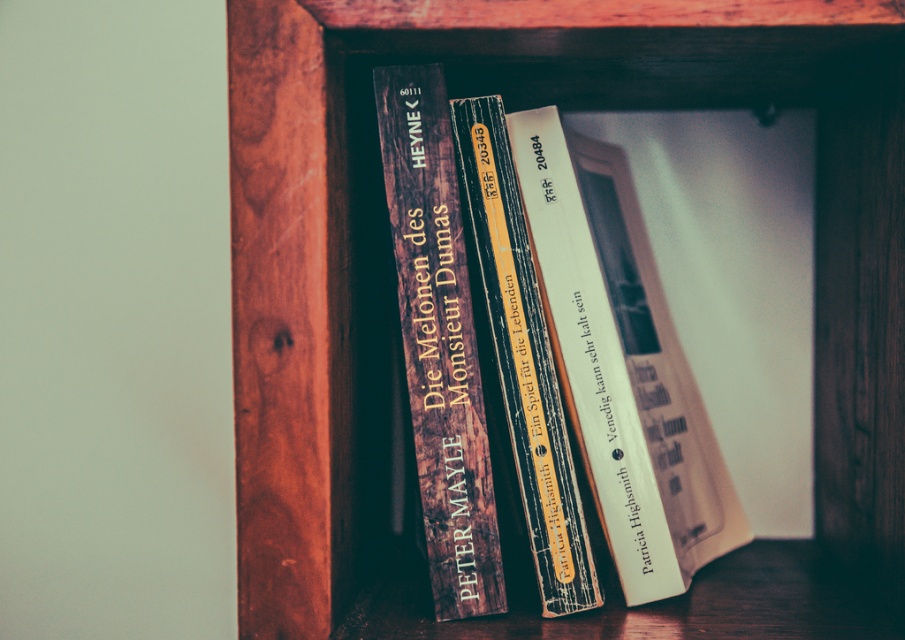
You are standing in front of the wooden bookshelf at center. If you were to place a new book on the shelf, where would you position it to maintain the existing arrangement of books shown in the scene?

The wooden bookshelf at center has books arranged vertically with their spines facing outward. To maintain the existing arrangement, you should place the new book vertically with its spine facing outward, next to the other books.

You are standing in front of the wooden bookshelf at center and notice a white paper book at center. Which object is closer to you?

The wooden bookshelf at center is closer to the viewer than the white paper book at center.

You are organizing books on a shelf and need to place a new book between the white paper book at center and the wooden spines at center. The new book is 5 centimeters thick. Is there enough space between them to fit the new book?

The white paper book at center and the wooden spines at center are 9.57 centimeters apart. Since the new book is only 5 centimeters thick, there is enough space to fit it between them.